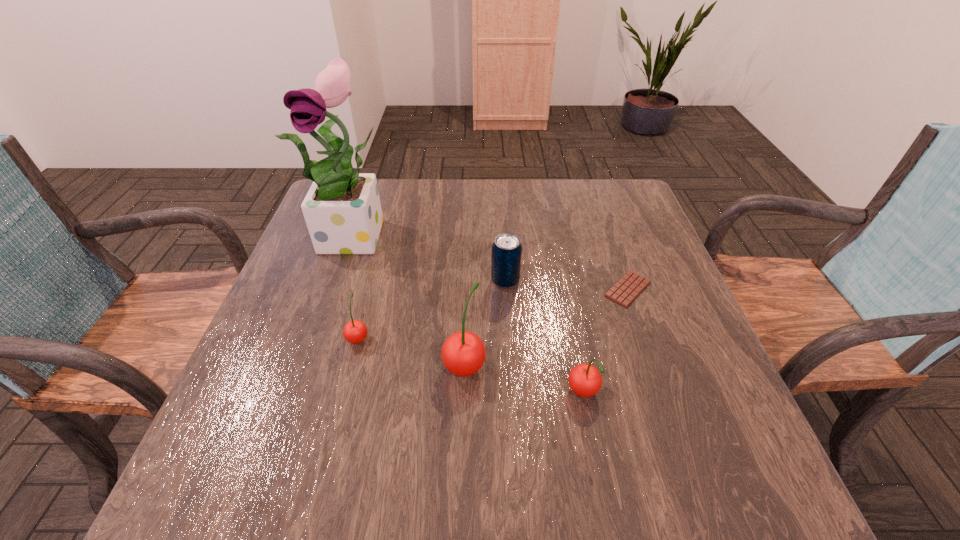
This screenshot has width=960, height=540. I want to click on the second shortest object, so click(355, 331).

This screenshot has height=540, width=960. I want to click on the shortest cherry, so click(x=355, y=331).

This screenshot has height=540, width=960. Find the location of `the fourth object from right to left`. the fourth object from right to left is located at coordinates (463, 353).

Find the location of a particular element. the second tallest object is located at coordinates (463, 353).

Find the location of `the second tallest cherry`. the second tallest cherry is located at coordinates (585, 380).

Find the location of a particular element. The height and width of the screenshot is (540, 960). the second object from right to left is located at coordinates (585, 380).

Identify the location of soda can. The width and height of the screenshot is (960, 540). (506, 255).

Identify the location of the tallest object. The height and width of the screenshot is (540, 960). (342, 209).

Locate an element on the screen. The width and height of the screenshot is (960, 540). flower arrangement is located at coordinates (342, 209).

Locate an element on the screen. The height and width of the screenshot is (540, 960). the shortest object is located at coordinates (624, 292).